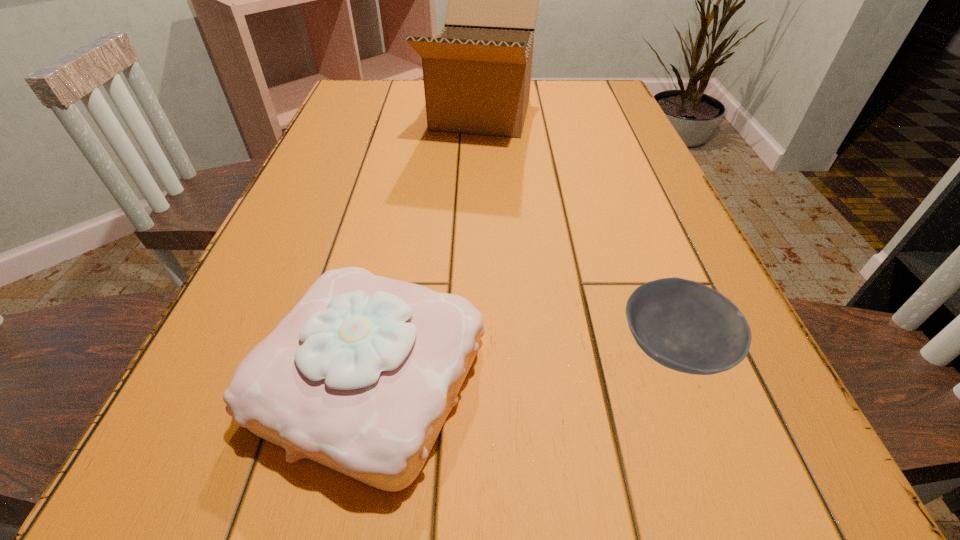
Image resolution: width=960 pixels, height=540 pixels. What are the coordinates of `the farthest object` in the screenshot? It's located at (477, 73).

The image size is (960, 540). I want to click on the tallest object, so click(x=477, y=73).

Locate an element on the screen. The width and height of the screenshot is (960, 540). cake is located at coordinates (360, 376).

The image size is (960, 540). What are the coordinates of `bowl` in the screenshot? It's located at (683, 325).

The image size is (960, 540). What are the coordinates of `the shortest object` in the screenshot? It's located at (683, 325).

Locate an element on the screen. vacant position located 0.090m on the right of the box is located at coordinates (571, 114).

Find the location of a particular element. The image size is (960, 540). free region located on the back of the second tallest object is located at coordinates (409, 193).

Locate an element on the screen. The height and width of the screenshot is (540, 960). free space located 0.190m on the left of the shortest object is located at coordinates (488, 349).

You are a GUI agent. You are given a task and a screenshot of the screen. Output one action in this format:
    pyautogui.click(x=<x>, y=<y>)
    Task: Click on the object that is positioned at the far edge
    
    Given the screenshot: What is the action you would take?
    pyautogui.click(x=477, y=73)

Where is `object located in the near edge section of the desktop`? object located in the near edge section of the desktop is located at coordinates coord(360,376).